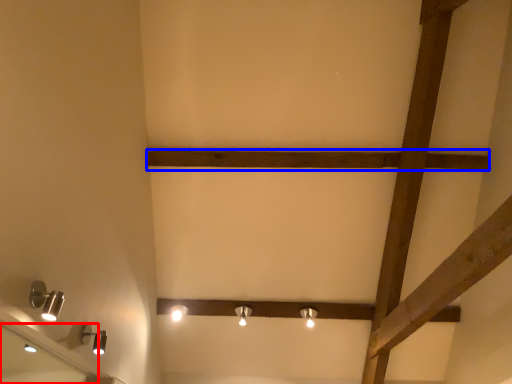
Question: Which object appears closest to the camera in this image, mirror (highlighted by a red box) or plank (highlighted by a blue box)?

Choices:
 (A) mirror
 (B) plank

Answer: (A)